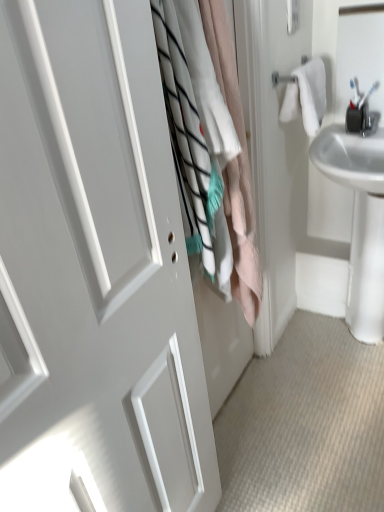
Question: Is white cotton laundry at center inside the boundaries of white glossy sink at right, or outside?

Choices:
 (A) outside
 (B) inside

Answer: (A)

Question: From their relative heights in the image, would you say white cotton laundry at center is taller or shorter than white glossy sink at right?

Choices:
 (A) tall
 (B) short

Answer: (A)

Question: Estimate the real-world distances between objects in this image. Which object is closer to the white cotton bath towel at upper right?

Choices:
 (A) white cotton laundry at center
 (B) white matte door at center
 (C) white glossy sink at right

Answer: (C)

Question: Estimate the real-world distances between objects in this image. Which object is farther from the white cotton laundry at center?

Choices:
 (A) white cotton bath towel at upper right
 (B) white matte door at center
 (C) white glossy sink at right

Answer: (C)